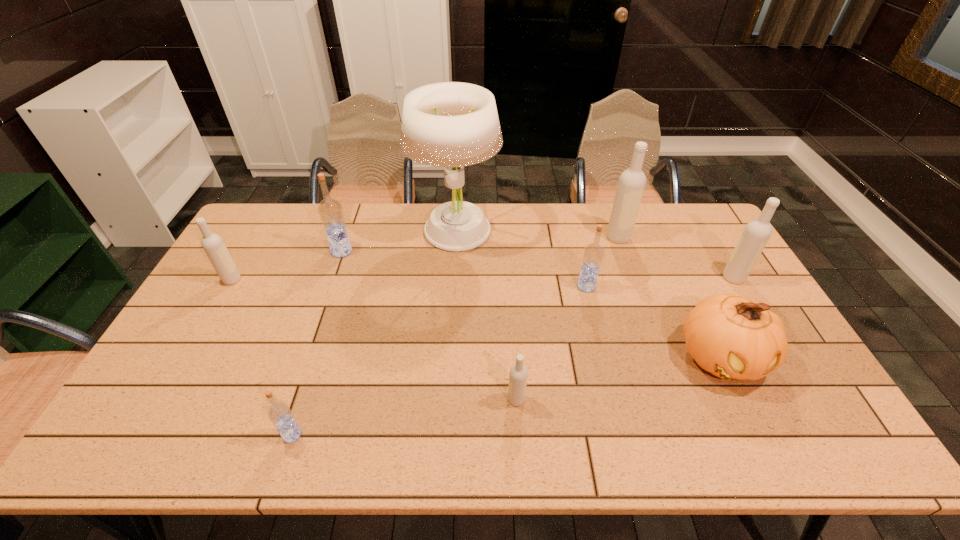
The height and width of the screenshot is (540, 960). Find the location of `the leftmost white vodka`. the leftmost white vodka is located at coordinates pyautogui.click(x=213, y=245).

Locate an element on the screen. the second object from right to left is located at coordinates (732, 337).

Image resolution: width=960 pixels, height=540 pixels. In order to click on the fourth vodka from left to right in this screenshot , I will do `click(518, 374)`.

At what (x,y) coordinates should I click in order to perform the action: click on the second nearest vodka. Please return your answer as a coordinate pair (x, y). Looking at the image, I should click on (518, 374).

Find the location of a particular element. The width and height of the screenshot is (960, 540). the nearest vodka is located at coordinates (279, 412).

Locate an element on the screen. The image size is (960, 540). the nearest blue vodka is located at coordinates (279, 412).

Find the location of a particular element. vacant space located on the front-facing side of the tallest object is located at coordinates (450, 310).

Locate an element on the screen. vacant area situated 0.320m on the right of the second vodka from right to left is located at coordinates (720, 238).

Where is `vacant space located on the right of the farthest blue vodka`? vacant space located on the right of the farthest blue vodka is located at coordinates (417, 251).

This screenshot has width=960, height=540. I want to click on blank area located 0.350m on the back of the rightmost vodka, so (692, 208).